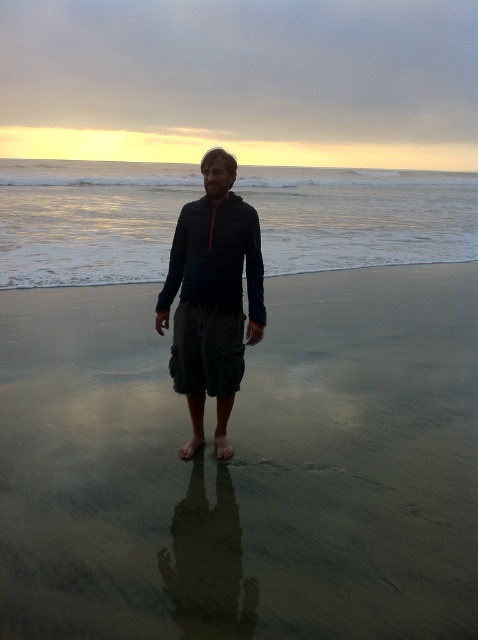
Is point (137, 433) less distant than point (308, 204)?

Yes, point (137, 433) is in front of point (308, 204).

Does sandy at center appear under clear water at center?

Yes, sandy at center is below clear water at center.

Image resolution: width=478 pixels, height=640 pixels. I want to click on sandy at center, so click(245, 467).

The width and height of the screenshot is (478, 640). Describe the element at coordinates (88, 220) in the screenshot. I see `clear water at center` at that location.

Which of these two, clear water at center or matte black hoodie at center, stands shorter?

matte black hoodie at center

What do you see at coordinates (88, 220) in the screenshot?
I see `clear water at center` at bounding box center [88, 220].

Where is `clear water at center`? The width and height of the screenshot is (478, 640). clear water at center is located at coordinates (88, 220).

The width and height of the screenshot is (478, 640). What do you see at coordinates (245, 467) in the screenshot?
I see `sandy at center` at bounding box center [245, 467].

At what (x,y) coordinates should I click in order to perform the action: click on sandy at center. Please return your answer as a coordinate pair (x, y). The height and width of the screenshot is (640, 478). Looking at the image, I should click on (245, 467).

Locate an element on the screen. sandy at center is located at coordinates (245, 467).